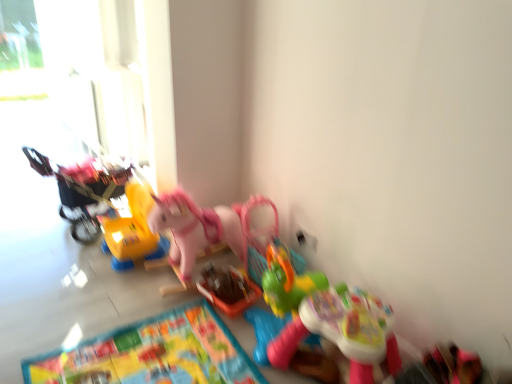
I want to click on unoccupied area behind multicolored fabric mat at lower center, so click(x=123, y=291).